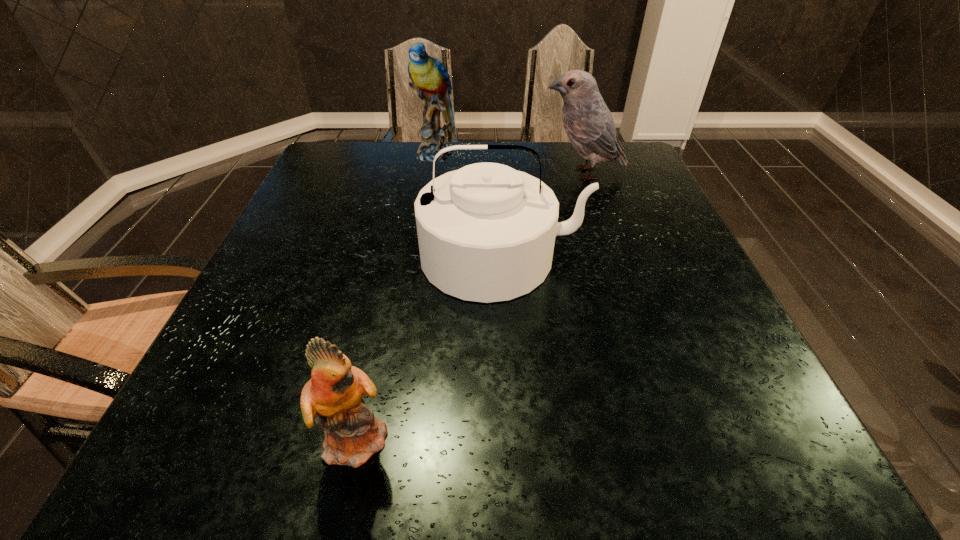
Find the location of `the rightmost parrot`. the rightmost parrot is located at coordinates (587, 121).

You are a GUI agent. You are given a task and a screenshot of the screen. Output one action in this format:
    pyautogui.click(x=<x>, y=<y>)
    Task: Click on the kettle
    The height and width of the screenshot is (540, 960).
    Given the screenshot: What is the action you would take?
    pyautogui.click(x=486, y=232)

Locate an element on the screen. the nearest object is located at coordinates (334, 393).

The image size is (960, 540). I want to click on free location located 0.210m on the front-facing side of the rightmost parrot, so click(x=464, y=173).

Locate an element on the screen. The height and width of the screenshot is (540, 960). vacant space located on the front-facing side of the rightmost parrot is located at coordinates (405, 173).

This screenshot has height=540, width=960. In order to click on vacant point located on the front-facing side of the rightmost parrot in this screenshot , I will do `click(514, 173)`.

I want to click on vacant space positioned on the spout of the kettle, so click(x=507, y=336).

The width and height of the screenshot is (960, 540). I want to click on free space located 0.380m on the front-facing side of the nearest object, so click(x=646, y=437).

You are a GUI agent. You are given a task and a screenshot of the screen. Output one action in this format:
    pyautogui.click(x=<x>, y=<y>)
    Task: Click on the object located in the near edge section of the desktop
    The image size is (960, 540).
    Given the screenshot: What is the action you would take?
    pyautogui.click(x=334, y=393)

Identify the location of object that is at the right edge. (587, 121).